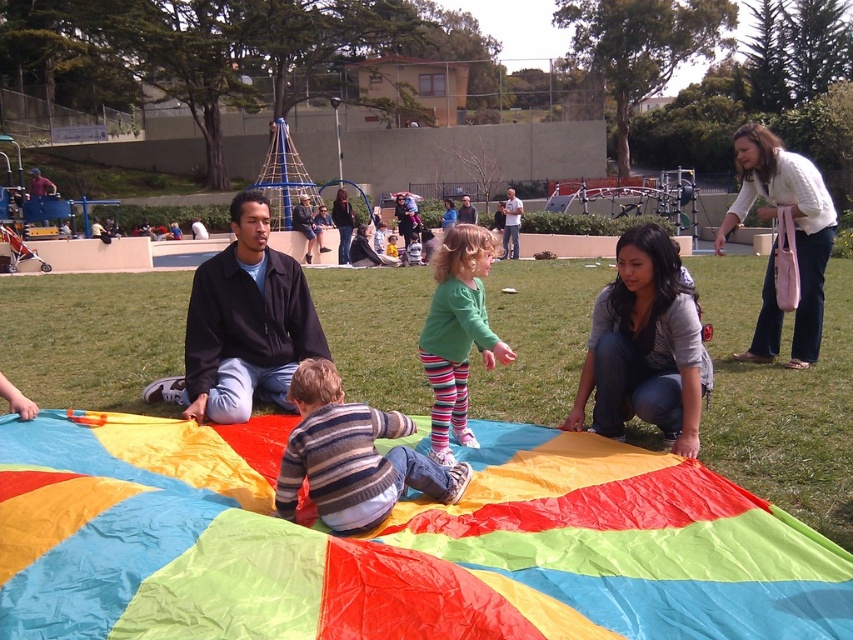
Is green grass at center positioned at the back of white sweater at upper right?

No, it is in front of white sweater at upper right.

What do you see at coordinates (780, 401) in the screenshot?
I see `green grass at center` at bounding box center [780, 401].

Locate an element on the screen. This screenshot has height=640, width=853. green grass at center is located at coordinates (780, 401).

Is multicolored fabric parachute at center above black matte jacket at left?

Actually, multicolored fabric parachute at center is below black matte jacket at left.

Who is more distant from viewer, [59,614] or [187,388]?

The point [187,388] is more distant.

The height and width of the screenshot is (640, 853). What are the coordinates of `multicolored fabric parachute at center` in the screenshot? It's located at (392, 544).

Is black matte jacket at left bigger than striped sweater at center?

No.

Measure the distance between black matte jacket at left and camera.

black matte jacket at left and camera are 5.25 meters apart.

Where is `black matte jacket at left`? black matte jacket at left is located at coordinates (242, 324).